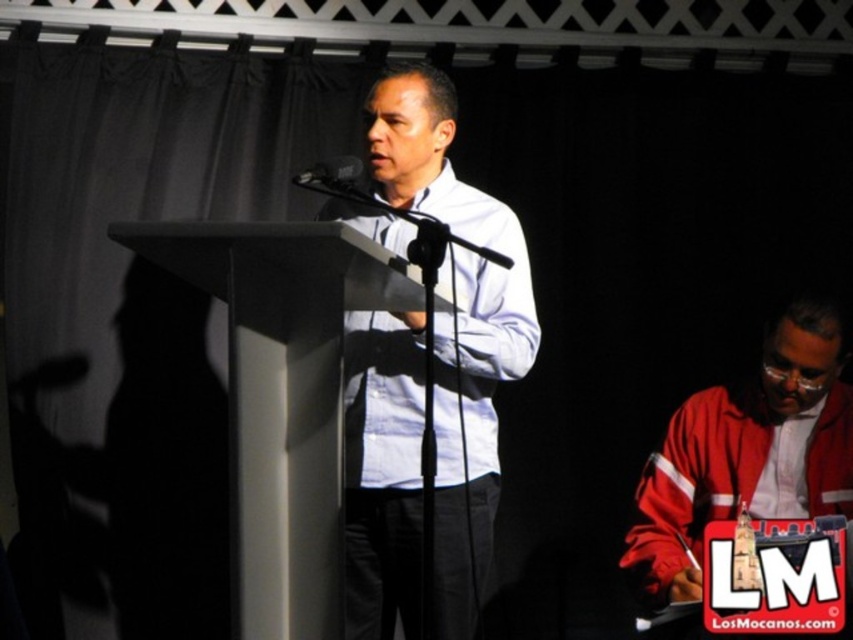
Is white smooth podium at center smaller than black matte microphone at center?

No, white smooth podium at center is not smaller than black matte microphone at center.

Does white smooth podium at center appear on the left side of black matte microphone at center?

Correct, you'll find white smooth podium at center to the left of black matte microphone at center.

Does point (190, 228) come closer to viewer compared to point (306, 182)?

That is True.

Find the location of a particular element. The width and height of the screenshot is (853, 640). white smooth podium at center is located at coordinates [x=282, y=397].

Based on the photo, which of these two, white matte shirt at center or red matte jacket at lower right, stands taller?

white matte shirt at center

Does white matte shirt at center have a greater height compared to red matte jacket at lower right?

Correct, white matte shirt at center is much taller as red matte jacket at lower right.

Who is more distant from viewer, (372, 445) or (680, 458)?

Point (680, 458)

Image resolution: width=853 pixels, height=640 pixels. I want to click on white matte shirt at center, so click(x=457, y=323).

Does white matte shirt at center have a smaller size compared to black matte microphone at center?

Actually, white matte shirt at center might be larger than black matte microphone at center.

Does point (457, 572) lie in front of point (318, 168)?

No, (457, 572) is further to viewer.

Describe the element at coordinates (457, 323) in the screenshot. I see `white matte shirt at center` at that location.

Locate an element on the screen. Image resolution: width=853 pixels, height=640 pixels. white matte shirt at center is located at coordinates (457, 323).